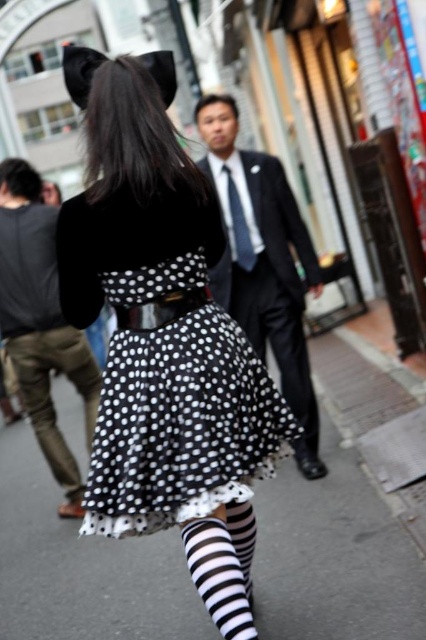
You are a fashion designer observing the scene. You need to place a new accessory exactly at the coordinates where the black velvet dress at center is located. What coordinates should you use?

The coordinates for the black velvet dress at center are at point (x=164, y=339).